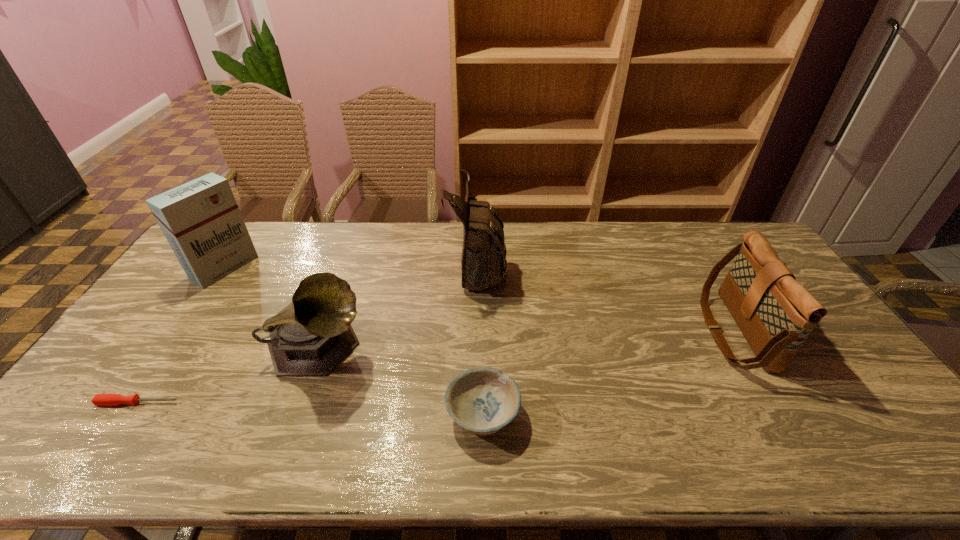
Locate an element on the screen. The width and height of the screenshot is (960, 540). screwdriver that is at the left edge is located at coordinates (99, 399).

Identify the location of object that is at the far left corner. The height and width of the screenshot is (540, 960). (200, 219).

Find the location of a particular element. free spot at the far edge of the desktop is located at coordinates (294, 224).

This screenshot has height=540, width=960. I want to click on vacant space at the near edge, so click(388, 435).

I want to click on free space at the left edge of the desktop, so point(86,422).

I want to click on vacant space at the near right corner, so pos(849,443).

This screenshot has height=540, width=960. Find the location of `empty space between the tallest object and the cigarette case`. empty space between the tallest object and the cigarette case is located at coordinates (351, 267).

Find the location of `vacant area that lies between the cigarette case and the shortest object`. vacant area that lies between the cigarette case and the shortest object is located at coordinates (181, 335).

This screenshot has height=540, width=960. In order to click on unoccupied area between the taller shoulder bag and the fifth tallest object in this screenshot , I will do `click(480, 340)`.

This screenshot has height=540, width=960. What are the coordinates of `vacant space in between the cigarette case and the phonograph record` in the screenshot? It's located at (272, 308).